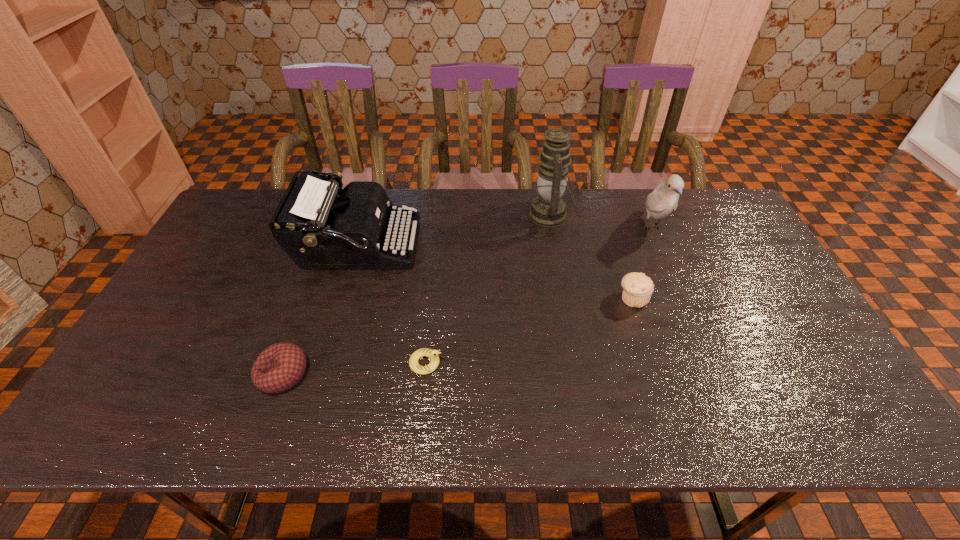
Image resolution: width=960 pixels, height=540 pixels. In order to click on free spot between the tallest object and the shortest object in this screenshot , I will do `click(488, 289)`.

I want to click on empty space that is in between the beanbag and the rightmost object, so click(468, 301).

I want to click on free space between the muffin and the fourth object from right to left, so click(529, 330).

Locate which object ranks third in proximity to the beanbag. Please provide its 2D coordinates. Your answer should be formatted as a tuple, i.e. [(x, y)], where the tuple contains the x and y coordinates of a point satisfying the conditions above.

[(548, 209)]

Find the location of a particular element. the second closest object to the duckling is located at coordinates (279, 367).

Where is `free space that satisfies the following two spatial constraints: 1. on the typing side of the second object from right to left; 2. on the right side of the third tallest object`? The width and height of the screenshot is (960, 540). free space that satisfies the following two spatial constraints: 1. on the typing side of the second object from right to left; 2. on the right side of the third tallest object is located at coordinates (342, 298).

Where is `vacant position in the image that satisfies the following two spatial constraints: 1. at the beak of the rightmost object; 2. on the face of the fourth object from right to left`? The width and height of the screenshot is (960, 540). vacant position in the image that satisfies the following two spatial constraints: 1. at the beak of the rightmost object; 2. on the face of the fourth object from right to left is located at coordinates (709, 363).

Locate an element on the screen. Image resolution: width=960 pixels, height=540 pixels. vacant space that satisfies the following two spatial constraints: 1. on the typing side of the third nearest object; 2. on the right side of the typewriter is located at coordinates (342, 298).

I want to click on blank area in the image that satisfies the following two spatial constraints: 1. on the back side of the muffin; 2. on the left side of the beanbag, so click(310, 298).